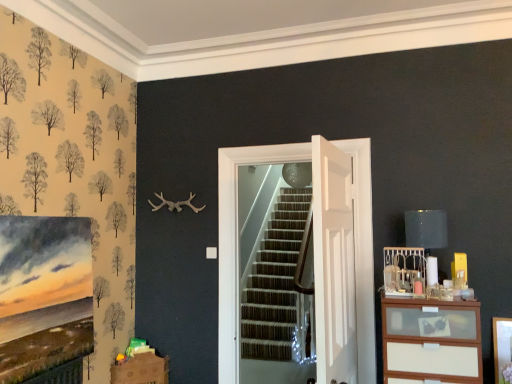
Image resolution: width=512 pixels, height=384 pixels. What are the coordinates of `white glossy door at center, the 2th door when ordered from back to front` in the screenshot? It's located at (333, 264).

What do you see at coordinates (141, 370) in the screenshot?
I see `brown cardboard drawer at lower left` at bounding box center [141, 370].

What is the approximate width of white wooden door at center, which appears as the second door when viewed from the front?

white wooden door at center, which appears as the second door when viewed from the front, is 7.56 inches wide.

What do you see at coordinates (431, 341) in the screenshot? I see `white wood chest of drawers at right` at bounding box center [431, 341].

The image size is (512, 384). Identify the location of matte black lampshade at upper right. (426, 229).

Consider the image. From a real-world perspective, between white glossy door at center, the 1th door in the front-to-back sequence, and white wooden door at center, the first door from the back, who is vertically lower?

white glossy door at center, the 1th door in the front-to-back sequence, from a real-world perspective.

How different are the orientations of white glossy door at center, the 1th door in the front-to-back sequence, and white wooden door at center, the first door from the back, in degrees?

The angular difference between white glossy door at center, the 1th door in the front-to-back sequence, and white wooden door at center, the first door from the back, is 85.4 degrees.

Which of these two, white glossy door at center, the 1th door in the front-to-back sequence, or white wooden door at center, which appears as the second door when viewed from the front, is smaller?

With smaller size is white glossy door at center, the 1th door in the front-to-back sequence.

Considering the positions of objects white wood chest of drawers at right and white wooden door at center, the first door from the back, in the image provided, who is more to the left, white wood chest of drawers at right or white wooden door at center, the first door from the back,?

white wooden door at center, the first door from the back.

Considering the sizes of objects white wood chest of drawers at right and white wooden door at center, which appears as the second door when viewed from the front, in the image provided, who is bigger, white wood chest of drawers at right or white wooden door at center, which appears as the second door when viewed from the front,?

white wooden door at center, which appears as the second door when viewed from the front.

Is white wood chest of drawers at right further to the viewer compared to white wooden door at center, the first door from the back?

No, white wood chest of drawers at right is closer to the viewer.

Between white wood chest of drawers at right and white wooden door at center, which appears as the second door when viewed from the front, which one has more height?

white wooden door at center, which appears as the second door when viewed from the front, is taller.

Is brown cardboard drawer at lower left to the left or to the right of white wooden door at center, which appears as the second door when viewed from the front, in the image?

In the image, brown cardboard drawer at lower left appears on the left side of white wooden door at center, which appears as the second door when viewed from the front.

Does brown cardboard drawer at lower left lie in front of white wooden door at center, the first door from the back?

No, brown cardboard drawer at lower left is further to the viewer.

Is brown cardboard drawer at lower left aimed at white wooden door at center, which appears as the second door when viewed from the front?

No, brown cardboard drawer at lower left is not oriented towards white wooden door at center, which appears as the second door when viewed from the front.

Considering the sizes of objects brown cardboard drawer at lower left and white glossy door at center, the 2th door when ordered from back to front, in the image provided, who is bigger, brown cardboard drawer at lower left or white glossy door at center, the 2th door when ordered from back to front,?

With larger size is white glossy door at center, the 2th door when ordered from back to front.

Is white glossy door at center, the 2th door when ordered from back to front, located within brown cardboard drawer at lower left?

No, white glossy door at center, the 2th door when ordered from back to front, is located outside of brown cardboard drawer at lower left.

From the image's perspective, starting from the brown cardboard drawer at lower left, which door is the 2nd one above? Please provide its 2D coordinates.

[(333, 264)]

Is brown cardboard drawer at lower left shorter than matte black lampshade at upper right?

Indeed, brown cardboard drawer at lower left has a lesser height compared to matte black lampshade at upper right.

From a real-world perspective, is brown cardboard drawer at lower left over matte black lampshade at upper right?

No, from a real-world perspective, brown cardboard drawer at lower left is not on top of matte black lampshade at upper right.

From the image's perspective, is brown cardboard drawer at lower left beneath matte black lampshade at upper right?

Yes, from the image's perspective, brown cardboard drawer at lower left is below matte black lampshade at upper right.

Based on their sizes in the image, would you say brown cardboard drawer at lower left is bigger or smaller than matte black lampshade at upper right?

brown cardboard drawer at lower left is bigger than matte black lampshade at upper right.

Does white glossy door at center, the 2th door when ordered from back to front, touch brown cardboard drawer at lower left?

No, white glossy door at center, the 2th door when ordered from back to front, is not with brown cardboard drawer at lower left.

Who is smaller, white glossy door at center, the 2th door when ordered from back to front, or brown cardboard drawer at lower left?

With smaller size is brown cardboard drawer at lower left.

Which object is closer to the camera taking this photo, white glossy door at center, the 1th door in the front-to-back sequence, or brown cardboard drawer at lower left?

white glossy door at center, the 1th door in the front-to-back sequence, is closer to the camera.

How different are the orientations of white glossy door at center, the 2th door when ordered from back to front, and brown cardboard drawer at lower left in degrees?

48.2 degrees.

Does point (404, 354) lie in front of point (131, 381)?

Yes.

Which is correct: white wood chest of drawers at right is inside brown cardboard drawer at lower left, or outside of it?

white wood chest of drawers at right cannot be found inside brown cardboard drawer at lower left.

Which is more to the right, white wood chest of drawers at right or brown cardboard drawer at lower left?

white wood chest of drawers at right.

Is white wood chest of drawers at right facing away from brown cardboard drawer at lower left?

No, white wood chest of drawers at right is not facing away from brown cardboard drawer at lower left.

This screenshot has width=512, height=384. What are the coordinates of `door that is on the right side of white wooden door at center, which appears as the second door when viewed from the front` in the screenshot? It's located at (333, 264).

Find the location of a particular element. the chest of drawers located underneath the white wooden door at center, which appears as the second door when viewed from the front (from a real-world perspective) is located at coordinates (431, 341).

Looking at the image, which one is located closer to brown cardboard drawer at lower left, white wood chest of drawers at right or matte black lampshade at upper right?

Based on the image, white wood chest of drawers at right appears to be nearer to brown cardboard drawer at lower left.

From the picture: Based on their spatial positions, is white wood chest of drawers at right or white wooden door at center, which appears as the second door when viewed from the front, further from matte black lampshade at upper right?

Based on the image, white wooden door at center, which appears as the second door when viewed from the front, appears to be further to matte black lampshade at upper right.

From the picture: Based on their spatial positions, is white wooden door at center, which appears as the second door when viewed from the front, or white glossy door at center, the 2th door when ordered from back to front, closer to matte black lampshade at upper right?

white glossy door at center, the 2th door when ordered from back to front, is positioned closer to the anchor matte black lampshade at upper right.

When comparing their distances from brown cardboard drawer at lower left, does matte black lampshade at upper right or white wooden door at center, the first door from the back, seem closer?

Based on the image, white wooden door at center, the first door from the back, appears to be nearer to brown cardboard drawer at lower left.

Estimate the real-world distances between objects in this image. Which object is closer to white wood chest of drawers at right, brown cardboard drawer at lower left or matte black lampshade at upper right?

matte black lampshade at upper right is positioned closer to the anchor white wood chest of drawers at right.

Consider the image. Looking at the image, which one is located further to brown cardboard drawer at lower left, matte black lampshade at upper right or white wood chest of drawers at right?

Among the two, matte black lampshade at upper right is located further to brown cardboard drawer at lower left.

From the image, which object appears to be farther from matte black lampshade at upper right, white wood chest of drawers at right or white glossy door at center, the 2th door when ordered from back to front?

white glossy door at center, the 2th door when ordered from back to front, is further to matte black lampshade at upper right.

Looking at the image, which one is located closer to white glossy door at center, the 1th door in the front-to-back sequence, white wooden door at center, which appears as the second door when viewed from the front, or white wood chest of drawers at right?

white wooden door at center, which appears as the second door when viewed from the front.

Find the location of a particular element. The height and width of the screenshot is (384, 512). chest of drawers between white glossy door at center, the 2th door when ordered from back to front, and matte black lampshade at upper right is located at coordinates (431, 341).

Find the location of a particular element. chest of drawers between white wooden door at center, which appears as the second door when viewed from the front, and matte black lampshade at upper right, in the horizontal direction is located at coordinates (431, 341).

The width and height of the screenshot is (512, 384). I want to click on the chest of drawers located between brown cardboard drawer at lower left and matte black lampshade at upper right in the left-right direction, so click(431, 341).

At what (x,y) coordinates should I click in order to perform the action: click on door located between white wooden door at center, which appears as the second door when viewed from the front, and matte black lampshade at upper right in the left-right direction. Please return your answer as a coordinate pair (x, y). Looking at the image, I should click on (333, 264).